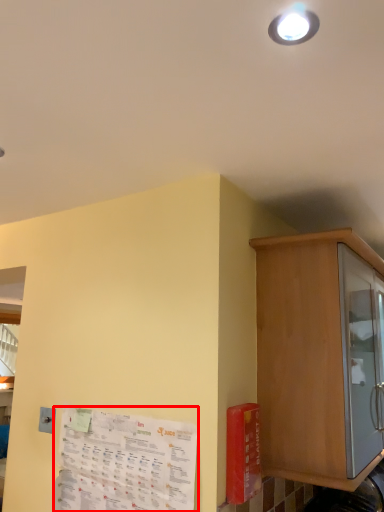
Question: From the image's perspective, where is paper (annotated by the red box) located in relation to cabinetry in the image?

Choices:
 (A) above
 (B) below

Answer: (B)